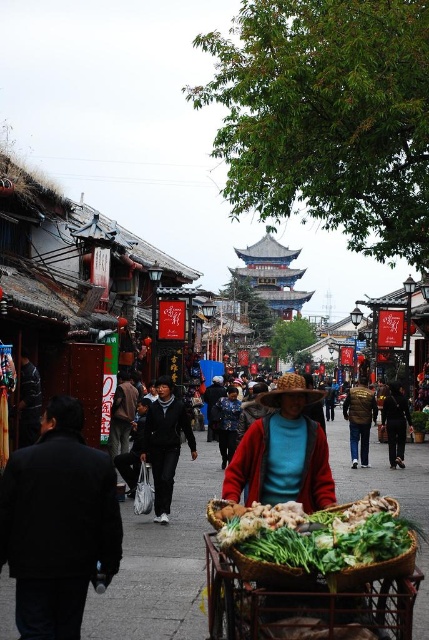
Does brown woven basket at center appear on the right side of red knitted hat at center?

Indeed, brown woven basket at center is positioned on the right side of red knitted hat at center.

How distant is brown woven basket at center from red knitted hat at center?

A distance of 29.69 feet exists between brown woven basket at center and red knitted hat at center.

Which is in front, point (124, 593) or point (311, 483)?

Point (124, 593) is in front.

Identify the location of brown woven basket at center. (160, 563).

Who is positioned more to the left, green leafy vegetables at center or red knitted hat at center?

From the viewer's perspective, red knitted hat at center appears more on the left side.

Who is shorter, green leafy vegetables at center or red knitted hat at center?

With less height is green leafy vegetables at center.

Where is `green leafy vegetables at center`? green leafy vegetables at center is located at coordinates (317, 540).

Who is higher up, brown woven basket at center or green leafy vegetables at lower center?

green leafy vegetables at lower center is higher up.

Who is positioned more to the right, brown woven basket at center or green leafy vegetables at lower center?

brown woven basket at center is more to the right.

Where is `brown woven basket at center`? This screenshot has height=640, width=429. brown woven basket at center is located at coordinates (160, 563).